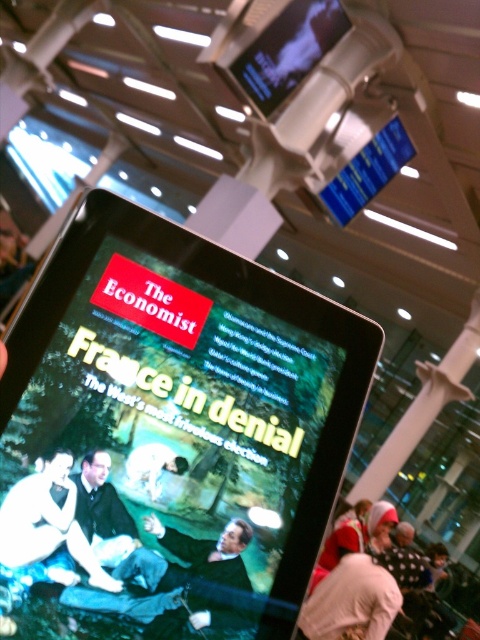
Does black glossy tablet at center appear over smooth skin figure at center?

Indeed, black glossy tablet at center is positioned over smooth skin figure at center.

This screenshot has height=640, width=480. What do you see at coordinates (169, 435) in the screenshot?
I see `black glossy tablet at center` at bounding box center [169, 435].

Is point (304, 333) farther from camera compared to point (86, 547)?

That is True.

This screenshot has width=480, height=640. I want to click on black glossy tablet at center, so click(x=169, y=435).

Is black glossy tablet at center wider than green fabric couch at center?

Yes.

Is point (146, 337) closer to camera compared to point (217, 566)?

No, (146, 337) is further to viewer.

Is point (129, 317) positioned in front of point (204, 540)?

No, (129, 317) is behind (204, 540).

Find the location of a particular element. The width and height of the screenshot is (480, 640). black glossy tablet at center is located at coordinates (169, 435).

Which is more to the right, white cotton sweater at lower right or smooth skin figure at center?

Positioned to the right is white cotton sweater at lower right.

I want to click on white cotton sweater at lower right, so click(x=363, y=582).